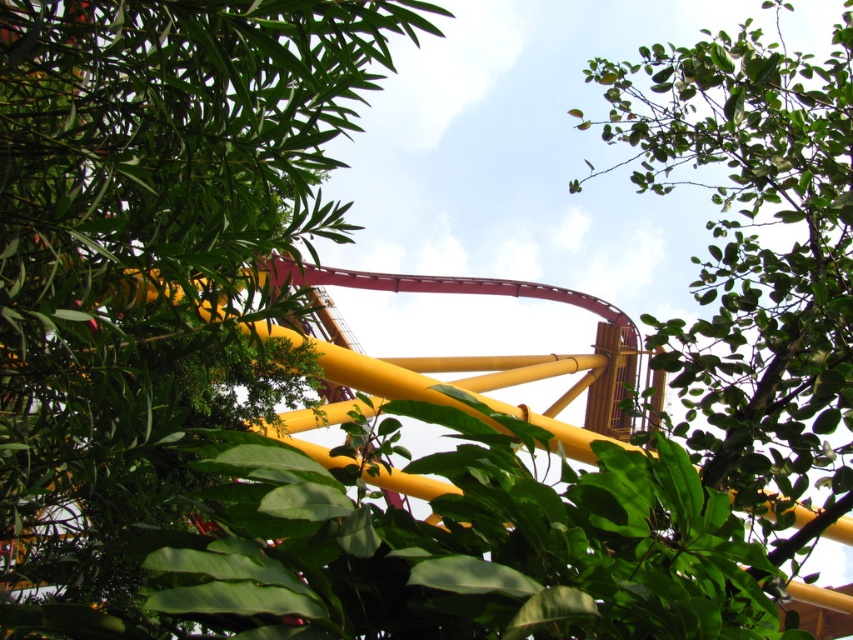
Question: Which of the following is the farthest from the observer?

Choices:
 (A) (778, 192)
 (B) (76, 387)

Answer: (A)

Question: Can you confirm if green leafy tree at upper left is wider than green leafy tree at upper center?

Choices:
 (A) no
 (B) yes

Answer: (B)

Question: Does green leafy tree at upper left appear under green leafy tree at upper center?

Choices:
 (A) yes
 (B) no

Answer: (A)

Question: Among these objects, which one is farthest from the camera?

Choices:
 (A) green leafy tree at upper left
 (B) green leafy tree at upper center

Answer: (B)

Question: Which object is closer to the camera taking this photo?

Choices:
 (A) green leafy tree at upper left
 (B) green leafy tree at upper center

Answer: (A)

Question: Is green leafy tree at upper left closer to camera compared to green leafy tree at upper center?

Choices:
 (A) yes
 (B) no

Answer: (A)